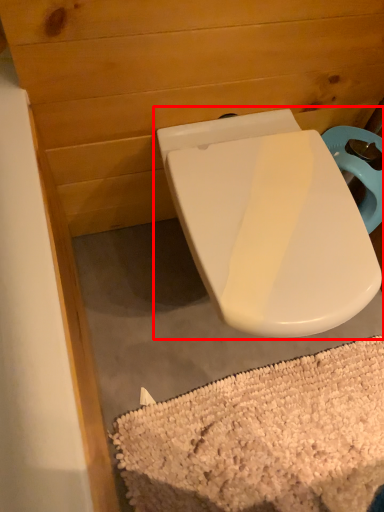
Question: From the image's perspective, what is the correct spatial relationship of toilet (annotated by the red box) in relation to bath mat?

Choices:
 (A) above
 (B) below

Answer: (A)